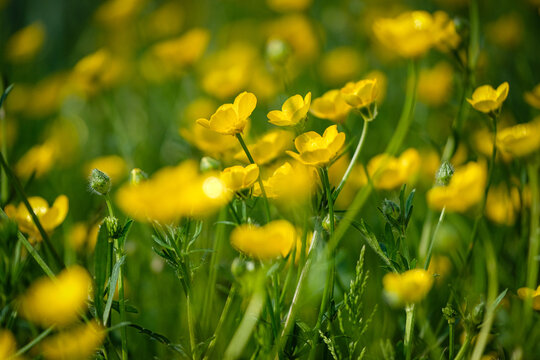
Locate an element on the screen. This screenshot has width=540, height=360. top-right-most flower is located at coordinates coord(509,32).